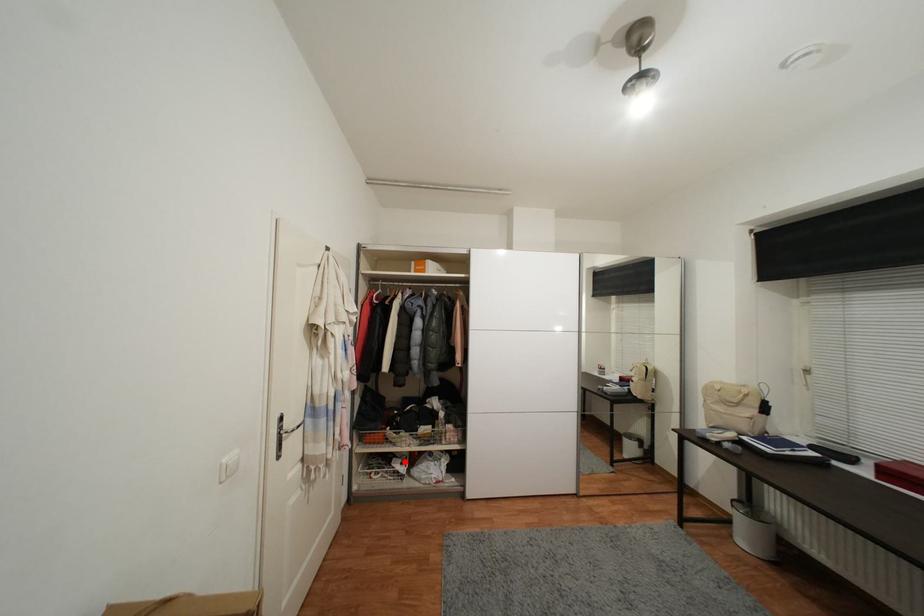
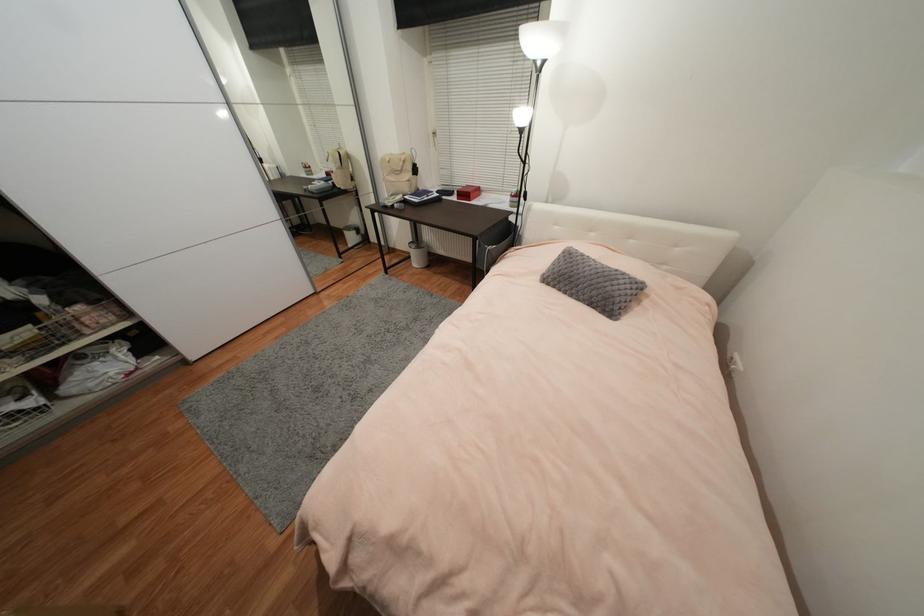
The point at the highlighted location is marked in the first image. Where is the corresponding point in the second image?

(14, 400)